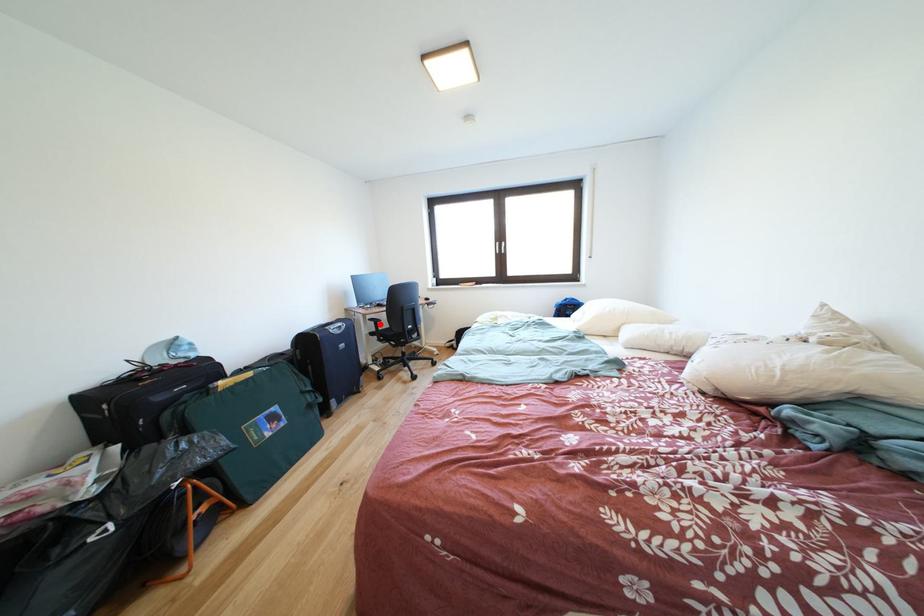
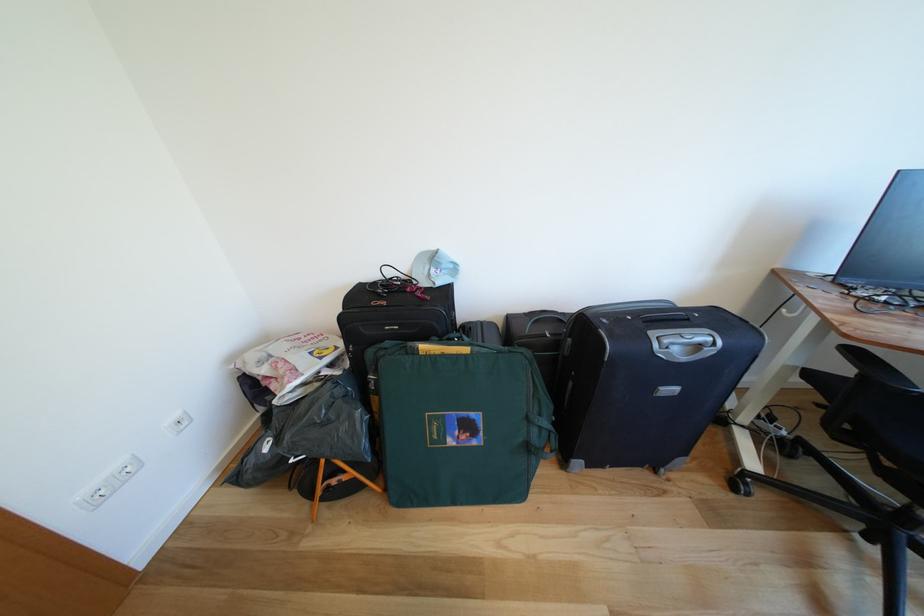
Question: I am providing you with two images of the same scene from different viewpoints. A red point is shown in image1. For the corresponding object point in image2, is it positioned nearer or farther from the camera?

Choices:
 (A) Nearer
 (B) Farther

Answer: (B)